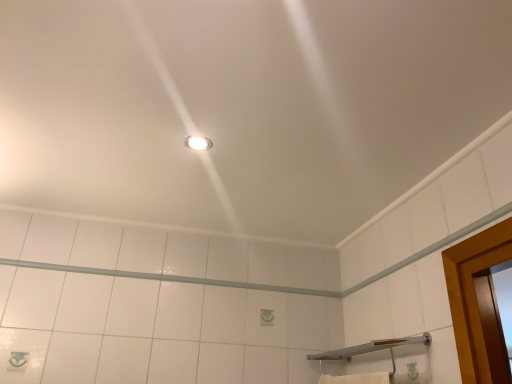
Question: From a real-world perspective, is silver metallic shower at lower right above or below matte white light fixture at center?

Choices:
 (A) above
 (B) below

Answer: (B)

Question: In the image, is silver metallic shower at lower right positioned in front of or behind matte white light fixture at center?

Choices:
 (A) front
 (B) behind

Answer: (A)

Question: Do you think silver metallic shower at lower right is within matte white light fixture at center, or outside of it?

Choices:
 (A) inside
 (B) outside

Answer: (B)

Question: Does point (205, 145) appear closer or farther from the camera than point (366, 347)?

Choices:
 (A) closer
 (B) farther

Answer: (A)

Question: Is matte white light fixture at center spatially inside silver metallic shower at lower right, or outside of it?

Choices:
 (A) outside
 (B) inside

Answer: (A)

Question: Looking at the image, does matte white light fixture at center seem bigger or smaller compared to silver metallic shower at lower right?

Choices:
 (A) big
 (B) small

Answer: (B)

Question: From the image's perspective, relative to silver metallic shower at lower right, is matte white light fixture at center above or below?

Choices:
 (A) above
 (B) below

Answer: (A)